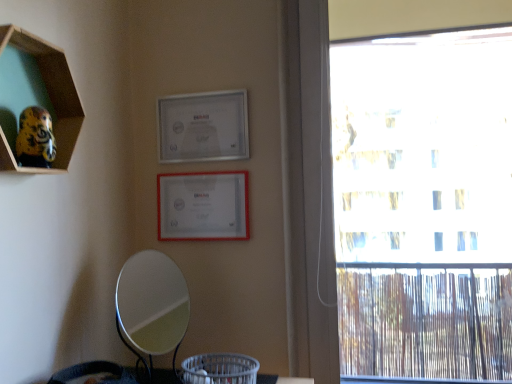
This screenshot has width=512, height=384. Describe the element at coordinates (203, 127) in the screenshot. I see `silver metallic picture frame at upper center, the second picture frame positioned from the bottom` at that location.

Find the location of a particular element. Image resolution: width=512 pixels, height=384 pixels. silver metallic picture frame at upper center, the second picture frame positioned from the bottom is located at coordinates (203, 127).

The height and width of the screenshot is (384, 512). Describe the element at coordinates (203, 206) in the screenshot. I see `white matte picture frame at upper center, which is counted as the first picture frame, starting from the bottom` at that location.

You are a GUI agent. You are given a task and a screenshot of the screen. Output one action in this format:
    pyautogui.click(x=<x>, y=<y>)
    Task: Click on the transparent glass window at right
    
    Given the screenshot: What is the action you would take?
    pyautogui.click(x=402, y=200)

The width and height of the screenshot is (512, 384). Find the location of `wooden hexagon at upper left`. wooden hexagon at upper left is located at coordinates (36, 103).

Find the location of `silver/metallic mirror at lower center`. silver/metallic mirror at lower center is located at coordinates (152, 303).

Measure the distance between silver metallic picture frame at upper center, which is the first picture frame from top to bottom, and transparent glass window at right.

silver metallic picture frame at upper center, which is the first picture frame from top to bottom, and transparent glass window at right are 1.15 meters apart.

From the picture: Is silver metallic picture frame at upper center, the second picture frame positioned from the bottom, oriented away from transparent glass window at right?

No, transparent glass window at right is not at the back of silver metallic picture frame at upper center, the second picture frame positioned from the bottom.

How many degrees apart are the facing directions of silver metallic picture frame at upper center, which is the first picture frame from top to bottom, and transparent glass window at right?

0.223 degrees.

Is transparent glass window at right a part of silver metallic picture frame at upper center, which is the first picture frame from top to bottom?

Actually, transparent glass window at right is outside silver metallic picture frame at upper center, which is the first picture frame from top to bottom.

Which is behind, point (218, 358) or point (185, 99)?

Point (185, 99)

From the image's perspective, is gray woven basket at lower center beneath silver metallic picture frame at upper center, the second picture frame positioned from the bottom?

Indeed, from the image's perspective, gray woven basket at lower center is shown beneath silver metallic picture frame at upper center, the second picture frame positioned from the bottom.

Is gray woven basket at lower center at the left side of silver metallic picture frame at upper center, which is the first picture frame from top to bottom?

In fact, gray woven basket at lower center is to the right of silver metallic picture frame at upper center, which is the first picture frame from top to bottom.

What's the angular difference between gray woven basket at lower center and silver metallic picture frame at upper center, the second picture frame positioned from the bottom,'s facing directions?

gray woven basket at lower center and silver metallic picture frame at upper center, the second picture frame positioned from the bottom, are facing 92.8 degrees away from each other.

Is wooden hexagon at upper left aimed at silver metallic picture frame at upper center, the second picture frame positioned from the bottom?

No, wooden hexagon at upper left does not turn towards silver metallic picture frame at upper center, the second picture frame positioned from the bottom.

In terms of size, does wooden hexagon at upper left appear bigger or smaller than silver metallic picture frame at upper center, which is the first picture frame from top to bottom?

In the image, wooden hexagon at upper left appears to be larger than silver metallic picture frame at upper center, which is the first picture frame from top to bottom.

From the image's perspective, which one is positioned lower, wooden hexagon at upper left or silver metallic picture frame at upper center, the second picture frame positioned from the bottom?

wooden hexagon at upper left is shown below in the image.

From the image's perspective, is white matte picture frame at upper center, marked as the 2th picture frame in a top-to-bottom arrangement, positioned above or below silver metallic picture frame at upper center, which is the first picture frame from top to bottom?

Clearly, from the image's perspective, white matte picture frame at upper center, marked as the 2th picture frame in a top-to-bottom arrangement, is below silver metallic picture frame at upper center, which is the first picture frame from top to bottom.

Looking at this image, does white matte picture frame at upper center, which is counted as the first picture frame, starting from the bottom, appear on the left side of silver metallic picture frame at upper center, which is the first picture frame from top to bottom?

Indeed, white matte picture frame at upper center, which is counted as the first picture frame, starting from the bottom, is positioned on the left side of silver metallic picture frame at upper center, which is the first picture frame from top to bottom.

Looking at their sizes, would you say white matte picture frame at upper center, which is counted as the first picture frame, starting from the bottom, is wider or thinner than silver metallic picture frame at upper center, the second picture frame positioned from the bottom?

Clearly, white matte picture frame at upper center, which is counted as the first picture frame, starting from the bottom, has less width compared to silver metallic picture frame at upper center, the second picture frame positioned from the bottom.

Can you confirm if white matte picture frame at upper center, marked as the 2th picture frame in a top-to-bottom arrangement, is bigger than silver metallic picture frame at upper center, which is the first picture frame from top to bottom?

Actually, white matte picture frame at upper center, marked as the 2th picture frame in a top-to-bottom arrangement, might be smaller than silver metallic picture frame at upper center, which is the first picture frame from top to bottom.

Which of these two, transparent glass window at right or white matte picture frame at upper center, marked as the 2th picture frame in a top-to-bottom arrangement, is smaller?

white matte picture frame at upper center, marked as the 2th picture frame in a top-to-bottom arrangement.

Is transparent glass window at right with white matte picture frame at upper center, marked as the 2th picture frame in a top-to-bottom arrangement?

No, transparent glass window at right is not beside white matte picture frame at upper center, marked as the 2th picture frame in a top-to-bottom arrangement.

Can you tell me how much transparent glass window at right and white matte picture frame at upper center, which is counted as the first picture frame, starting from the bottom, differ in facing direction?

0.223 degrees.

Is transparent glass window at right looking in the opposite direction of white matte picture frame at upper center, marked as the 2th picture frame in a top-to-bottom arrangement?

No, white matte picture frame at upper center, marked as the 2th picture frame in a top-to-bottom arrangement, is not at the back of transparent glass window at right.

Considering the relative positions of transparent glass window at right and silver/metallic mirror at lower center in the image provided, is transparent glass window at right to the left or to the right of silver/metallic mirror at lower center?

In the image, transparent glass window at right appears on the right side of silver/metallic mirror at lower center.

In the scene shown: Could you tell me if transparent glass window at right is facing silver/metallic mirror at lower center?

No, transparent glass window at right is not facing towards silver/metallic mirror at lower center.

In terms of width, does transparent glass window at right look wider or thinner when compared to silver/metallic mirror at lower center?

Considering their sizes, transparent glass window at right looks slimmer than silver/metallic mirror at lower center.

Find the location of `mirror on the left of transparent glass window at right`. mirror on the left of transparent glass window at right is located at coordinates (152, 303).

Is gray woven basket at lower center looking in the opposite direction of silver/metallic mirror at lower center?

Yes, gray woven basket at lower center is facing away from silver/metallic mirror at lower center.

In the scene shown: Which point is more distant from viewer, (236, 378) or (138, 324)?

Point (138, 324)

From a real-world perspective, is gray woven basket at lower center on silver/metallic mirror at lower center?

No, from a real-world perspective, gray woven basket at lower center is not over silver/metallic mirror at lower center

Is the surface of gray woven basket at lower center in direct contact with silver/metallic mirror at lower center?

No, gray woven basket at lower center is not beside silver/metallic mirror at lower center.

Locate an element on the screen. picture frame above the transparent glass window at right (from the image's perspective) is located at coordinates (203, 127).

Locate an element on the screen. basket below the silver metallic picture frame at upper center, which is the first picture frame from top to bottom (from the image's perspective) is located at coordinates (220, 369).

Which object lies further to the anchor point transparent glass window at right, silver/metallic mirror at lower center or silver metallic picture frame at upper center, which is the first picture frame from top to bottom?

The object further to transparent glass window at right is silver/metallic mirror at lower center.

Looking at the image, which one is located further to silver metallic picture frame at upper center, which is the first picture frame from top to bottom, white matte picture frame at upper center, which is counted as the first picture frame, starting from the bottom, or transparent glass window at right?

transparent glass window at right lies further to silver metallic picture frame at upper center, which is the first picture frame from top to bottom, than the other object.

Estimate the real-world distances between objects in this image. Which object is closer to transparent glass window at right, gray woven basket at lower center or wooden hexagon at upper left?

wooden hexagon at upper left.

From the image, which object appears to be nearer to gray woven basket at lower center, silver/metallic mirror at lower center or silver metallic picture frame at upper center, the second picture frame positioned from the bottom?

silver/metallic mirror at lower center.

Based on the photo, considering their positions, is white matte picture frame at upper center, which is counted as the first picture frame, starting from the bottom, positioned further to gray woven basket at lower center than silver/metallic mirror at lower center?

white matte picture frame at upper center, which is counted as the first picture frame, starting from the bottom, lies further to gray woven basket at lower center than the other object.

Which object lies further to the anchor point silver metallic picture frame at upper center, the second picture frame positioned from the bottom, wooden hexagon at upper left or transparent glass window at right?

transparent glass window at right is positioned further to the anchor silver metallic picture frame at upper center, the second picture frame positioned from the bottom.

Considering their positions, is wooden hexagon at upper left positioned further to transparent glass window at right than white matte picture frame at upper center, marked as the 2th picture frame in a top-to-bottom arrangement?

wooden hexagon at upper left lies further to transparent glass window at right than the other object.

Based on their spatial positions, is silver metallic picture frame at upper center, the second picture frame positioned from the bottom, or wooden hexagon at upper left further from gray woven basket at lower center?

Based on the image, wooden hexagon at upper left appears to be further to gray woven basket at lower center.

The image size is (512, 384). Identify the location of picture frame between white matte picture frame at upper center, which is counted as the first picture frame, starting from the bottom, and transparent glass window at right. (203, 127).

Locate an element on the screen. The width and height of the screenshot is (512, 384). picture frame between wooden hexagon at upper left and white matte picture frame at upper center, marked as the 2th picture frame in a top-to-bottom arrangement, from front to back is located at coordinates (203, 127).

At what (x,y) coordinates should I click in order to perform the action: click on mirror located between wooden hexagon at upper left and white matte picture frame at upper center, marked as the 2th picture frame in a top-to-bottom arrangement, in the depth direction. Please return your answer as a coordinate pair (x, y). Image resolution: width=512 pixels, height=384 pixels. Looking at the image, I should click on (152, 303).

At what (x,y) coordinates should I click in order to perform the action: click on basket between silver metallic picture frame at upper center, the second picture frame positioned from the bottom, and transparent glass window at right from left to right. Please return your answer as a coordinate pair (x, y). The width and height of the screenshot is (512, 384). Looking at the image, I should click on (220, 369).